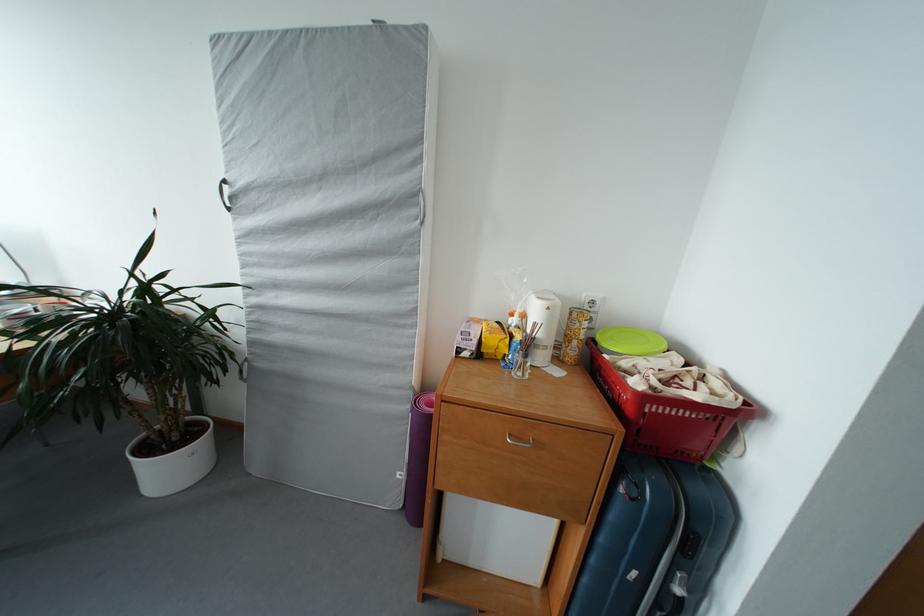
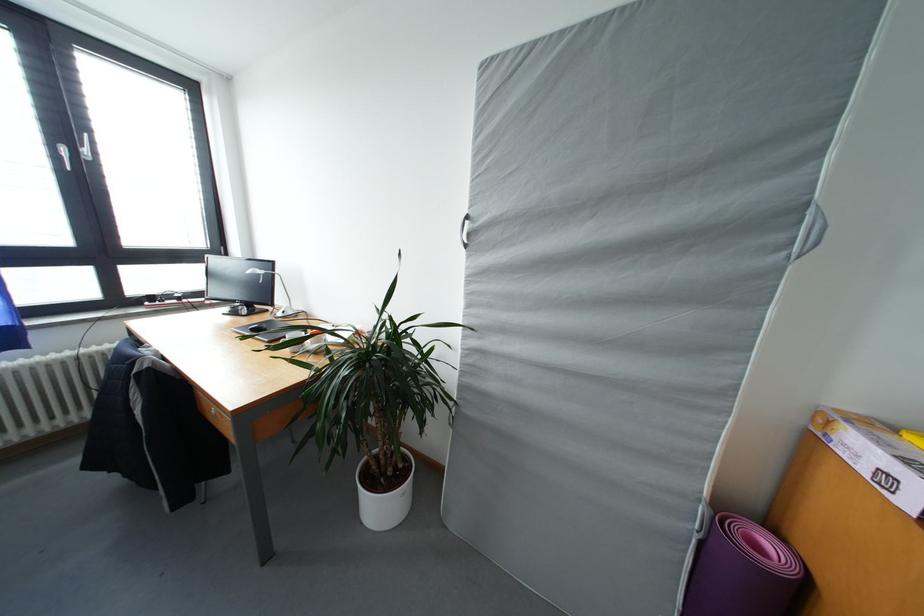
The point at (232,187) is marked in the first image. Where is the corresponding point in the second image?

(473, 222)